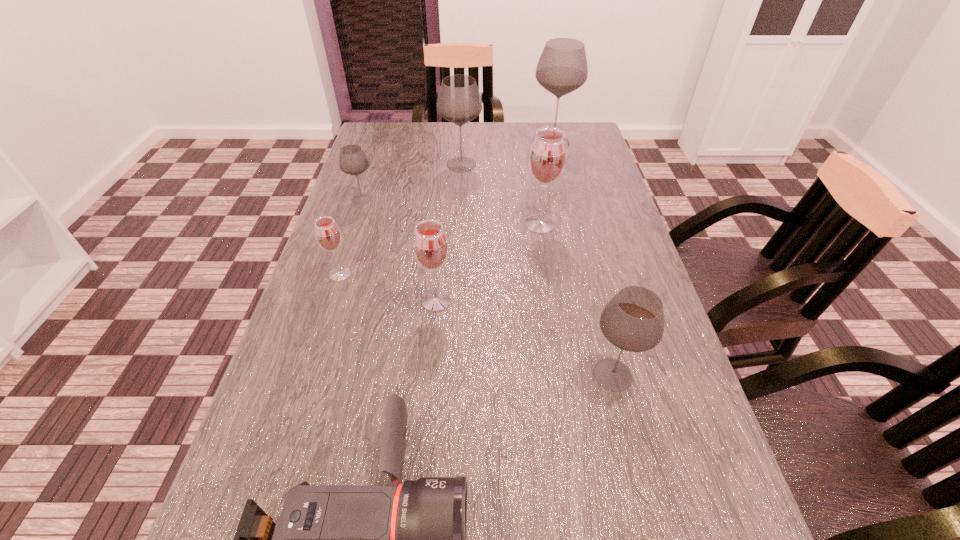
You are a GUI agent. You are given a task and a screenshot of the screen. Output one action in this format:
    pyautogui.click(x=<x>, y=<y>)
    Task: Click on the gray wineglass that is the third closest one to the fourth farthest object
    The image size is (960, 540).
    Given the screenshot: What is the action you would take?
    pyautogui.click(x=633, y=320)

Where is `gray wineglass that stands as the third closest to the sixth farthest object`? Image resolution: width=960 pixels, height=540 pixels. gray wineglass that stands as the third closest to the sixth farthest object is located at coordinates (459, 101).

Locate which red wineglass is the second closest to the third smallest gray wineglass. Please provide its 2D coordinates. Your answer should be formatted as a tuple, i.e. [(x, y)], where the tuple contains the x and y coordinates of a point satisfying the conditions above.

[(328, 236)]

Find the location of `red wineglass that is the nearest to the second red wineglass from left to right`. red wineglass that is the nearest to the second red wineglass from left to right is located at coordinates (328, 236).